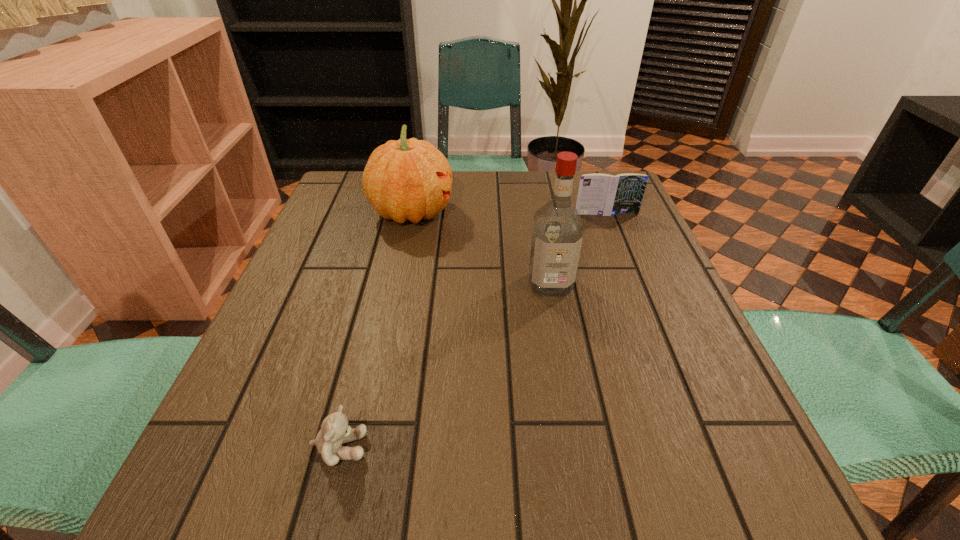
Identify the location of vacant space that is in between the tallest object and the pumpkin. (481, 248).

Identify which object is the second closest to the second object from right to left. Please provide its 2D coordinates. Your answer should be formatted as a tuple, i.e. [(x, y)], where the tuple contains the x and y coordinates of a point satisfying the conditions above.

[(599, 194)]

Locate which object ranks in proximity to the second tallest object. Please provide its 2D coordinates. Your answer should be formatted as a tuple, i.e. [(x, y)], where the tuple contains the x and y coordinates of a point satisfying the conditions above.

[(557, 235)]

Where is `vacant space that satisfies the following two spatial constraints: 1. on the front cover of the second shortest object; 2. on the face of the nearest object`? The height and width of the screenshot is (540, 960). vacant space that satisfies the following two spatial constraints: 1. on the front cover of the second shortest object; 2. on the face of the nearest object is located at coordinates (698, 448).

The width and height of the screenshot is (960, 540). Identify the location of vacant region that satisfies the following two spatial constraints: 1. on the front cover of the rightmost object; 2. on the face of the nearest object. (698, 448).

Locate an element on the screen. The image size is (960, 540). blank space that satisfies the following two spatial constraints: 1. on the front cover of the book; 2. on the face of the shortest object is located at coordinates (698, 448).

The image size is (960, 540). In order to click on free spot that satisfies the following two spatial constraints: 1. on the front-facing side of the third farthest object; 2. on the face of the teddy bear in this screenshot , I will do `click(580, 448)`.